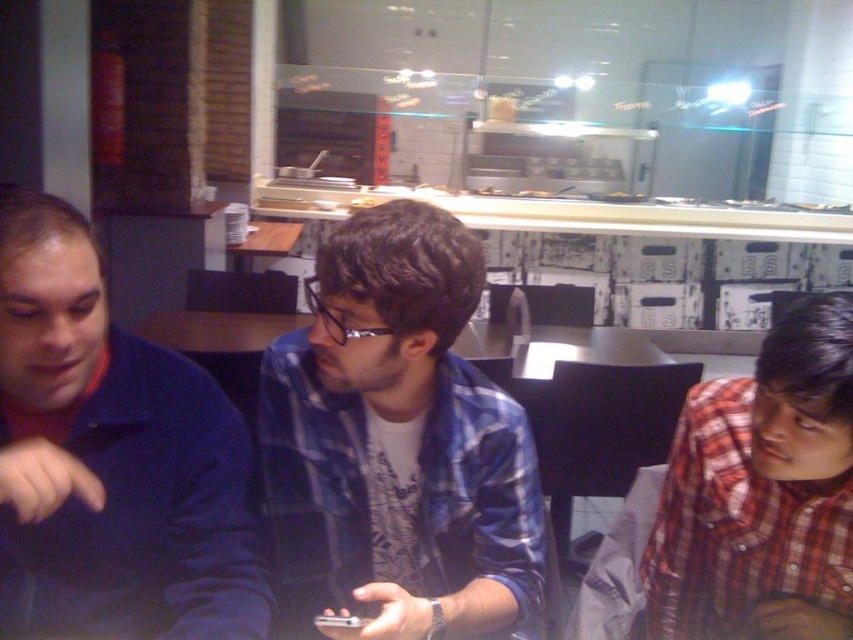
Which of these two, blue plaid shirt at center or blue cotton shirt at left, stands taller?

With more height is blue plaid shirt at center.

Can you confirm if blue plaid shirt at center is positioned above blue cotton shirt at left?

No, blue plaid shirt at center is not above blue cotton shirt at left.

Is point (364, 508) less distant than point (183, 493)?

No, (364, 508) is behind (183, 493).

Identify the location of blue plaid shirt at center. (397, 444).

Does blue plaid shirt at center appear on the right side of plaid shirt at right?

Incorrect, blue plaid shirt at center is not on the right side of plaid shirt at right.

Does point (306, 442) come farther from viewer compared to point (668, 497)?

No.

You are a GUI agent. You are given a task and a screenshot of the screen. Output one action in this format:
    pyautogui.click(x=<x>, y=<y>)
    Task: Click on the blue plaid shirt at center
    
    Given the screenshot: What is the action you would take?
    pyautogui.click(x=397, y=444)

Does blue cotton shirt at left have a lesser height compared to plaid shirt at right?

No.

Based on the photo, measure the distance from blue cotton shirt at left to plaid shirt at right.

The distance of blue cotton shirt at left from plaid shirt at right is 28.25 inches.

This screenshot has height=640, width=853. I want to click on blue cotton shirt at left, so click(112, 458).